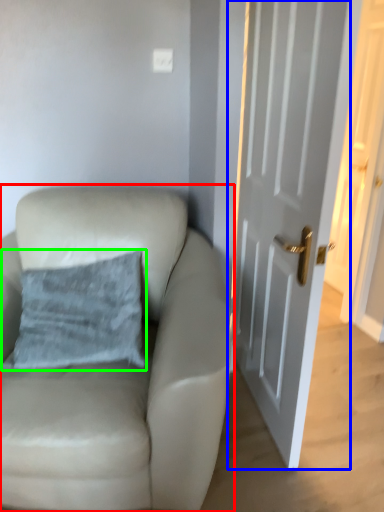
Question: Which object is the closest to the chair (highlighted by a red box)? Choose among these: door (highlighted by a blue box) or pillow (highlighted by a green box).

Choices:
 (A) door
 (B) pillow

Answer: (B)